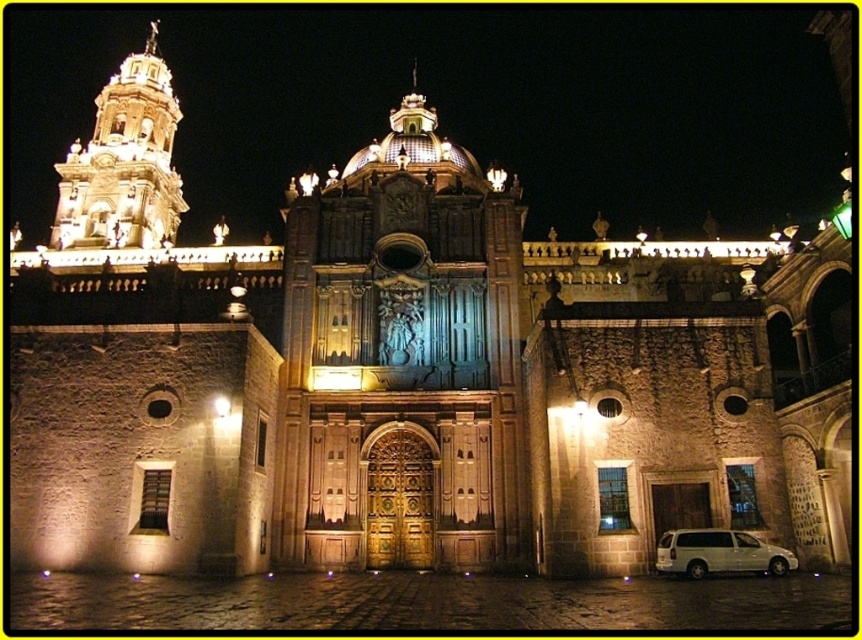
Based on the photo, you are standing in front of the cathedral and want to take a photo of the golden stone tower at center and the white matte van at lower right. Which object should you pan your camera to the left to capture first?

You should pan your camera to the left to capture the golden stone tower at center first because it is positioned to the left of the white matte van at lower right.